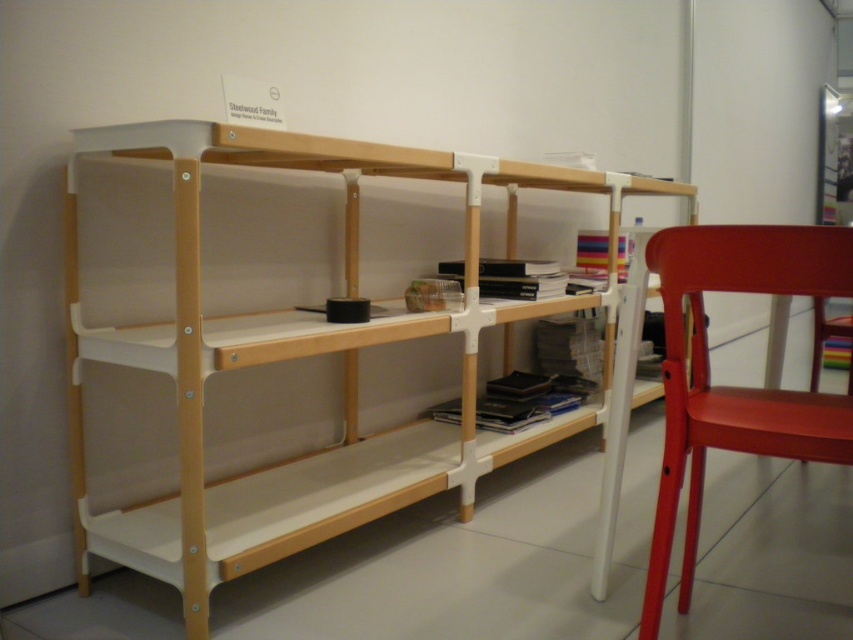
You are standing in front of the white matte bookshelf at center. If you want to reach the top shelf, which is 1.8 meters high, can you do it without any assistance?

The white matte bookshelf at center is 1.8 meters high. Since the distance between you and the bookshelf is 1.19 meters, you might need to step closer or use a stool to reach the top shelf comfortably.

Consider the image. You are moving a large potted plant that is 1.2 meters wide. You want to place it near the white matte bookshelf at center and the matte red chair at right. Based on their sizes, can the potted plant fit between them without touching either?

The white matte bookshelf at center has a larger size compared to matte red chair at right. Since the potted plant is 1.2 meters wide, it may not fit between them if the space between the two objects is narrower than 1.2 meters. However, the exact distance isn generated in the provided information, so we cannot determine this with certainty.

You are standing in front of the white matte bookshelf at center and want to move to the matte red chair at right. Can you walk directly to the chair without moving around the bookshelf?

The white matte bookshelf at center is positioned over the matte red chair at right, meaning the bookshelf is blocking the path. You cannot walk directly to the chair without moving around the bookshelf.